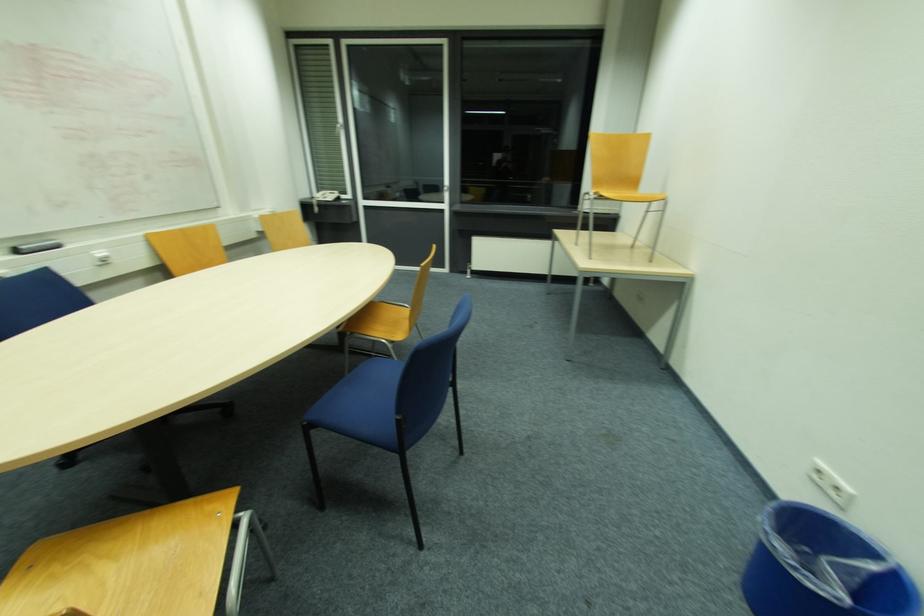
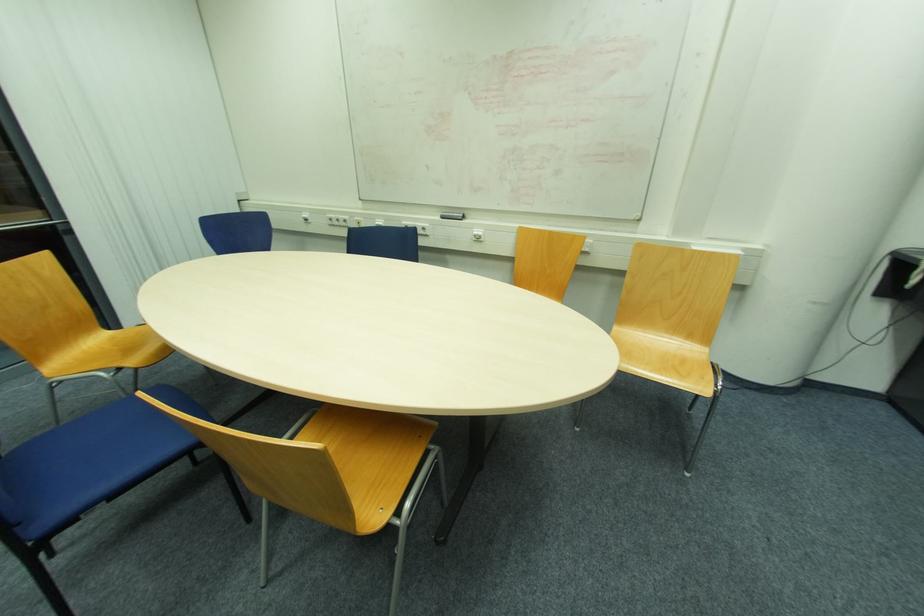
Find the pixel in the second image that matches (x=101, y=256) in the first image.

(477, 233)